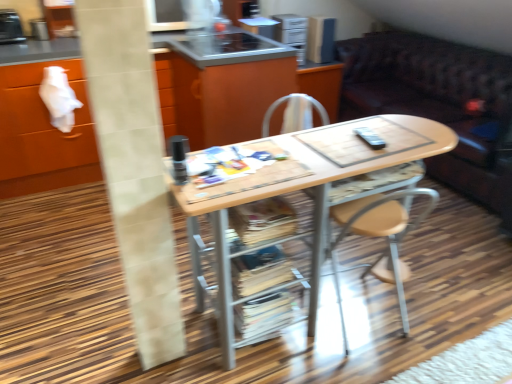
You are a GUI agent. You are given a task and a screenshot of the screen. Output one action in this format:
    pyautogui.click(x=<x>, y=<y>)
    Task: Click on the free space above wooden/matte desk at center (from a real-world perspective)
    The image size is (512, 384).
    Given the screenshot: What is the action you would take?
    pyautogui.click(x=339, y=150)